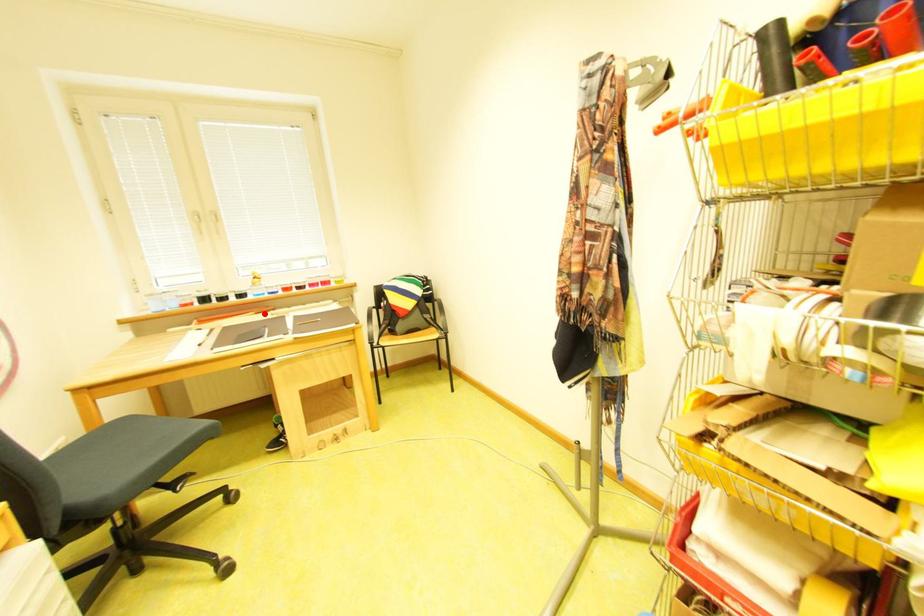
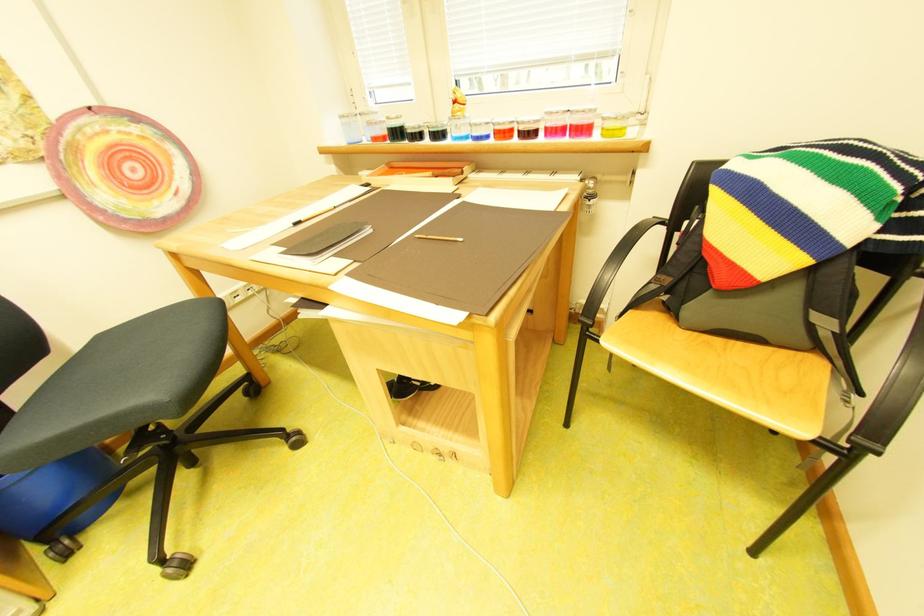
In the second image, find the point that corresponds to the highlighted location in the first image.

(441, 175)